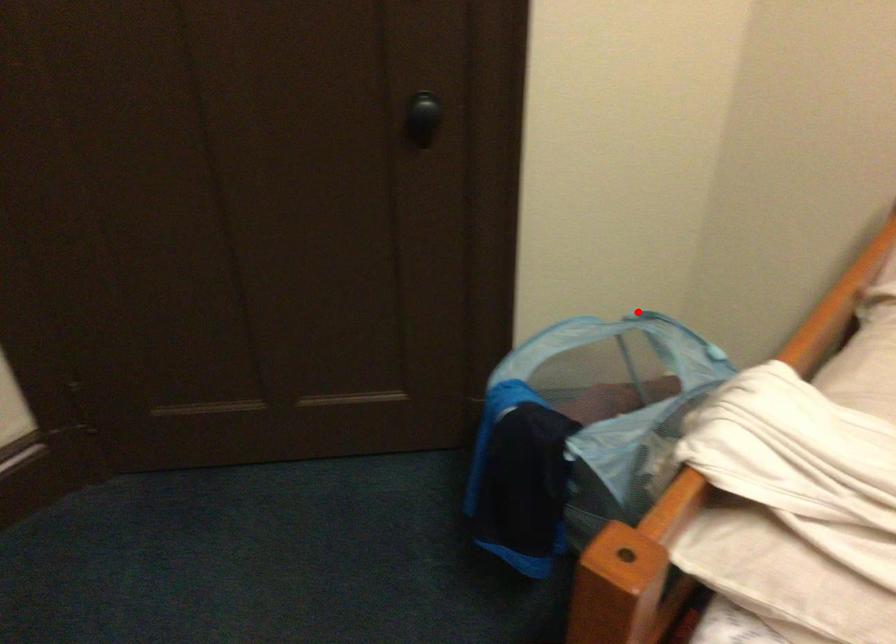
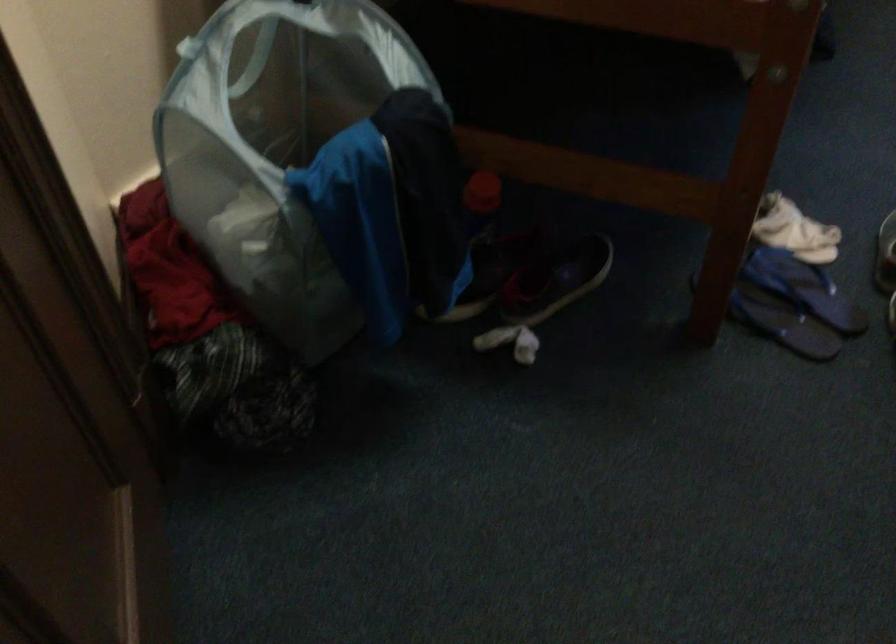
Question: I am providing you with two images of the same scene from different viewpoints. A red point is shown in image1. For the corresponding object point in image2, is it positioned nearer or farther from the camera?

Choices:
 (A) Nearer
 (B) Farther

Answer: (A)